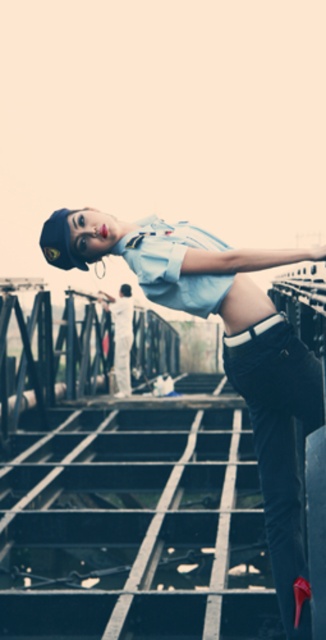
Between light blue uniform at center and velvet black pants at lower right, which one appears on the right side from the viewer's perspective?

From the viewer's perspective, velvet black pants at lower right appears more on the right side.

Identify the location of light blue uniform at center. The width and height of the screenshot is (326, 640). (223, 349).

At what (x,y) coordinates should I click in order to perform the action: click on light blue uniform at center. Please return your answer as a coordinate pair (x, y). Looking at the image, I should click on (223, 349).